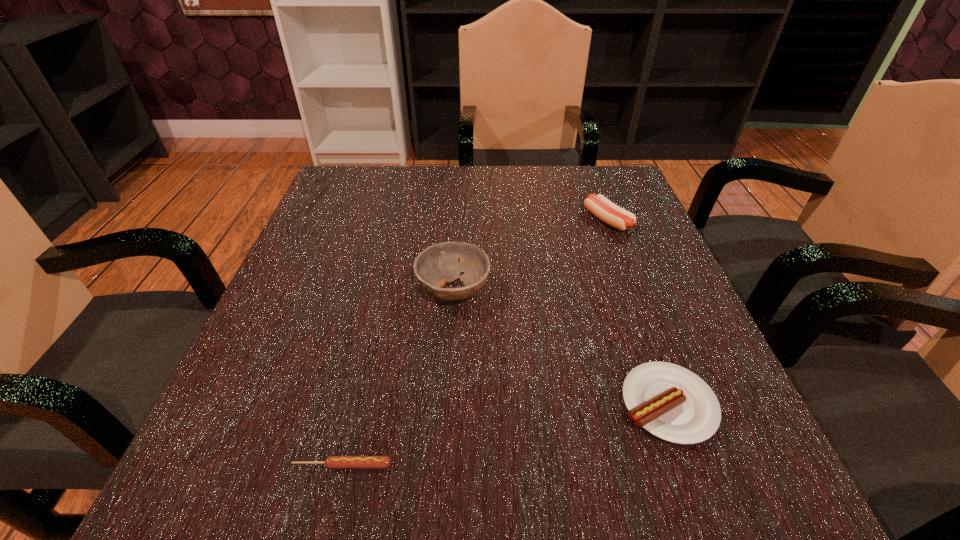
Image resolution: width=960 pixels, height=540 pixels. Identify the location of free space located 0.240m on the right of the shortest sausage. (576, 465).

Where is `object that is at the far edge`? The image size is (960, 540). object that is at the far edge is located at coordinates (601, 207).

You are a GUI agent. You are given a task and a screenshot of the screen. Output one action in this format:
    pyautogui.click(x=<x>, y=<y>)
    Task: Click on the object present at the left edge
    
    Given the screenshot: What is the action you would take?
    pyautogui.click(x=331, y=462)

Identify the location of object at the near left corner. (331, 462).

The image size is (960, 540). In order to click on object that is at the far right corner in this screenshot , I will do `click(601, 207)`.

At what (x,y) coordinates should I click in order to perform the action: click on object located at the near right corner. Please return your answer as a coordinate pair (x, y). Looking at the image, I should click on (672, 403).

The image size is (960, 540). I want to click on blank area at the far edge, so [x=536, y=174].

The height and width of the screenshot is (540, 960). I want to click on vacant space at the near edge of the desktop, so click(x=393, y=482).

Locate an element on the screen. The width and height of the screenshot is (960, 540). vacant region at the left edge of the desktop is located at coordinates (364, 260).

This screenshot has width=960, height=540. In order to click on blank area at the far left corner in this screenshot , I will do `click(393, 167)`.